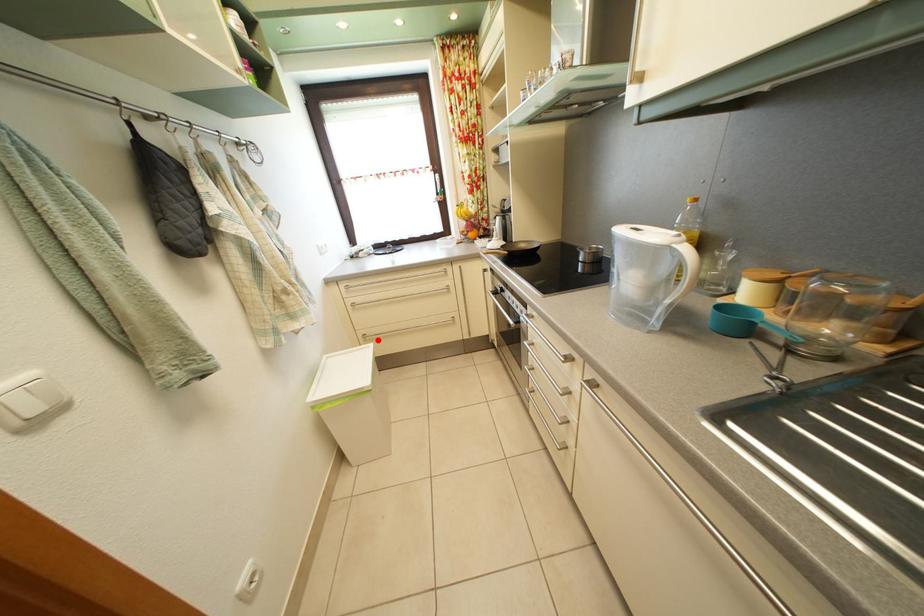
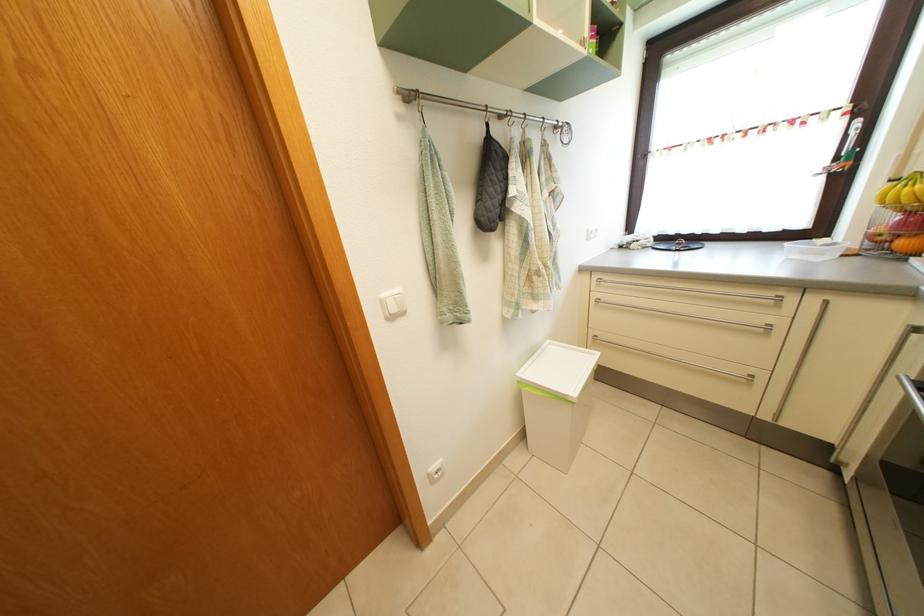
Find the pixel in the second image that matches the highlighted location in the first image.

(611, 344)